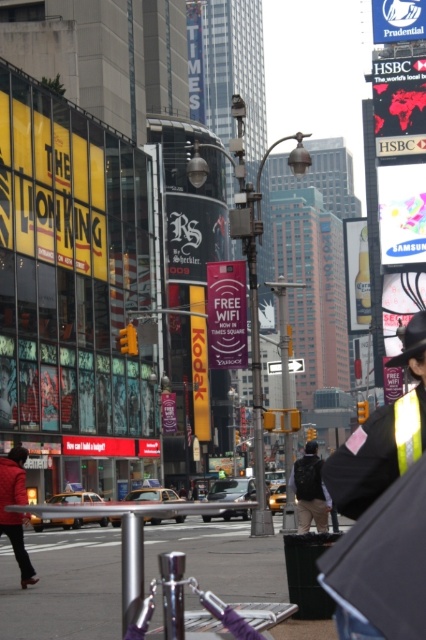
Does black matte umbrella at lower right have a larger size compared to dark gray backpack at center?

Incorrect, black matte umbrella at lower right is not larger than dark gray backpack at center.

Does point (391, 548) come farther from viewer compared to point (316, 515)?

No, (391, 548) is closer to viewer.

This screenshot has width=426, height=640. What are the coordinates of `black matte umbrella at lower right` in the screenshot? It's located at (382, 564).

Is point (374, 563) in front of point (409, 355)?

Yes, point (374, 563) is in front of point (409, 355).

Describe the element at coordinates (382, 564) in the screenshot. I see `black matte umbrella at lower right` at that location.

This screenshot has height=640, width=426. I want to click on black matte umbrella at lower right, so click(382, 564).

Based on the photo, is reflective silver jacket at center above red matte jacket at lower left?

Correct, reflective silver jacket at center is located above red matte jacket at lower left.

Can you confirm if reflective silver jacket at center is taller than red matte jacket at lower left?

Incorrect, reflective silver jacket at center's height is not larger of red matte jacket at lower left's.

What are the coordinates of `reflective silver jacket at center` in the screenshot? It's located at (382, 436).